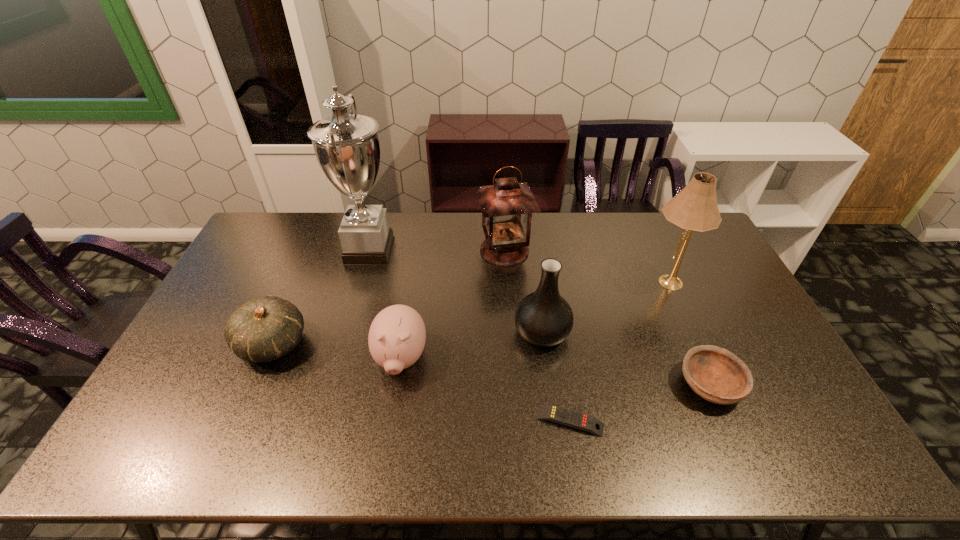
Where is `vacant space that satisfies the following two spatial constraints: 1. on the front side of the oil lamp; 2. on the right side of the seventh shortest object`? vacant space that satisfies the following two spatial constraints: 1. on the front side of the oil lamp; 2. on the right side of the seventh shortest object is located at coordinates (506, 282).

Find the location of a particular element. This screenshot has height=540, width=960. free space that satisfies the following two spatial constraints: 1. at the front view of the seventh shortest object; 2. on the right side of the trophy cup is located at coordinates (360, 282).